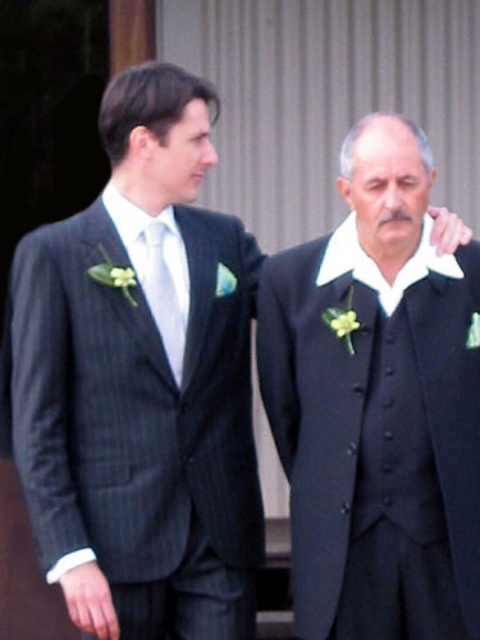
You are a photographer adjusting your camera settings to focus on two specific points in the image. The points are labeled as point [439,604] and point [154,304]. Since you want to ensure both points are in focus, which point should you set as your focus point to achieve the sharpest image given the depth of field?

Point [439,604] is closer to the camera than point [154,304]. To achieve the sharpest image with both points in focus, you should set the focus point on the closer one, which is point [439,604]. This will ensure the depth of field extends backward to cover the farther point as well.

You are a tailor measuring the width of the pinstripe fabric suit at left and the matte silver tie at center for alterations. Which item has a greater width?

The pinstripe fabric suit at left has a greater width than the matte silver tie at center according to the description.

You are a photographer setting up for a group photo. You need to position two men wearing formal suits so that they are exactly 24 inches apart. Currently, the black textured suit at center and pinstripe fabric suit at left are 22.93 inches apart from each other. Do you need to adjust their positions to meet the requirement?

The black textured suit at center and pinstripe fabric suit at left are currently 22.93 inches apart, which is less than the required 24 inches. To meet the requirement, you should move them slightly farther apart.